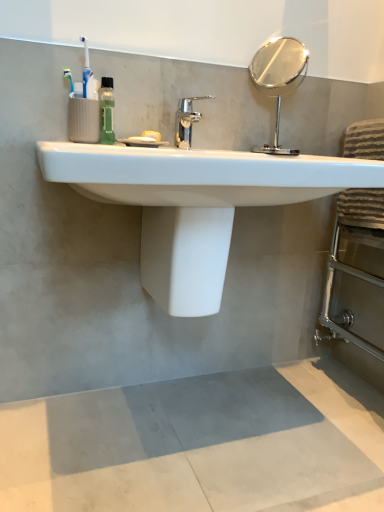
Locate an element on the screen. vacant space underneath brown striped towel at right (from a real-world perspective) is located at coordinates (339, 388).